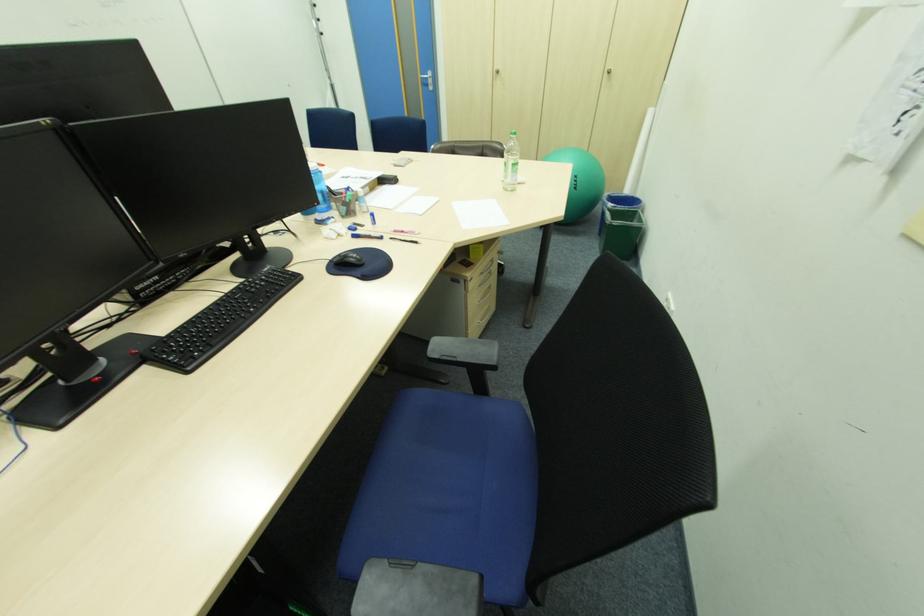
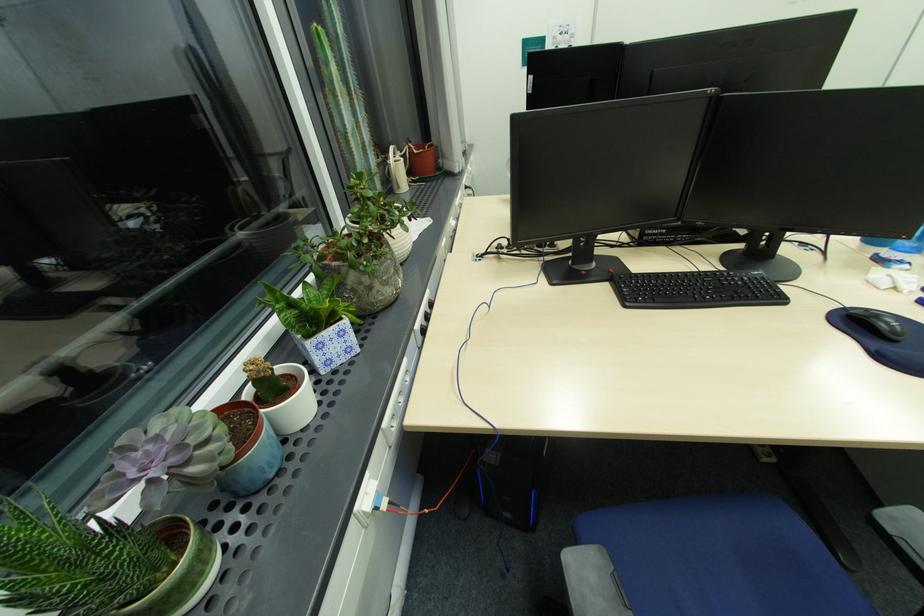
Find the pixel in the second image that matches point 341,261 in the first image.

(857, 312)